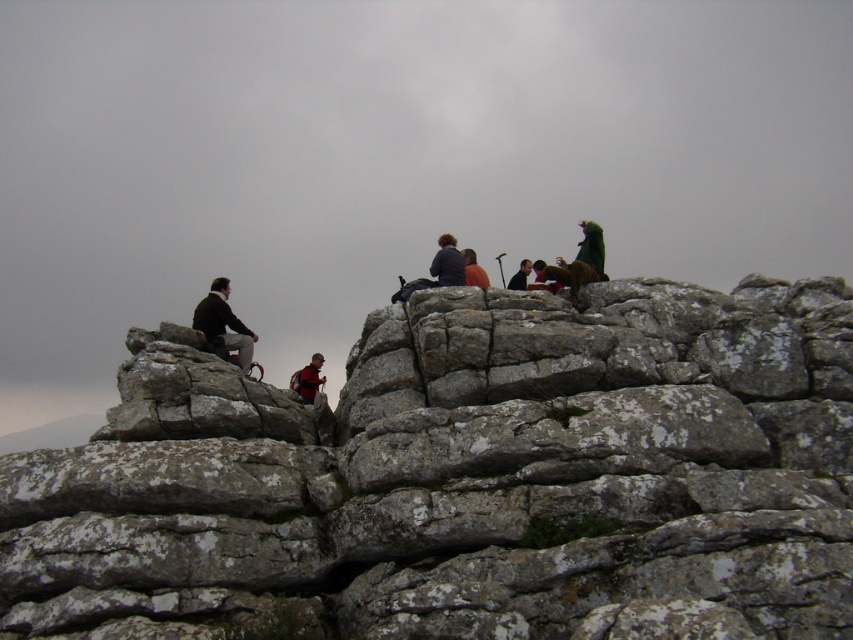
Between green fuzzy costume at upper center and red fabric jacket at center, which one has less height?

green fuzzy costume at upper center

This screenshot has height=640, width=853. What do you see at coordinates (569, 275) in the screenshot?
I see `green fuzzy costume at upper center` at bounding box center [569, 275].

Identify the location of green fuzzy costume at upper center. Image resolution: width=853 pixels, height=640 pixels. (569, 275).

Between red fabric jacket at center and orange cotton shirt at center, which one appears on the left side from the viewer's perspective?

Positioned to the left is red fabric jacket at center.

Is red fabric jacket at center further to camera compared to orange cotton shirt at center?

Yes, red fabric jacket at center is further from the viewer.

Who is more forward, (315, 376) or (479, 268)?

Positioned in front is point (479, 268).

Locate an element on the screen. The height and width of the screenshot is (640, 853). red fabric jacket at center is located at coordinates (308, 380).

Does green fuzzy costume at upper center have a greater height compared to orange cotton shirt at center?

In fact, green fuzzy costume at upper center may be shorter than orange cotton shirt at center.

Who is more forward, [575,289] or [471,275]?

Point [575,289] is more forward.

Who is more forward, (567, 269) or (465, 282)?

Point (567, 269)

Locate an element on the screen. This screenshot has width=853, height=640. green fuzzy costume at upper center is located at coordinates (569, 275).